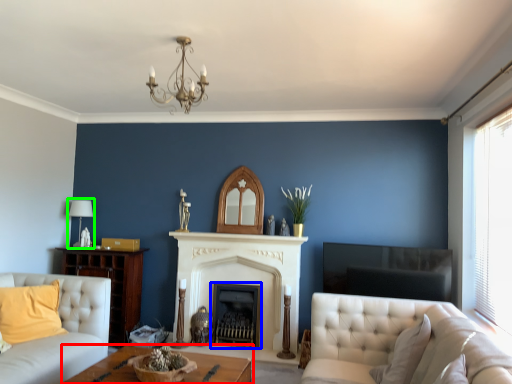
Question: Which object is positioned farthest from table (highlighted by a red box)? Select from fireplace (highlighted by a blue box) and lamp (highlighted by a green box).

Choices:
 (A) fireplace
 (B) lamp

Answer: (B)